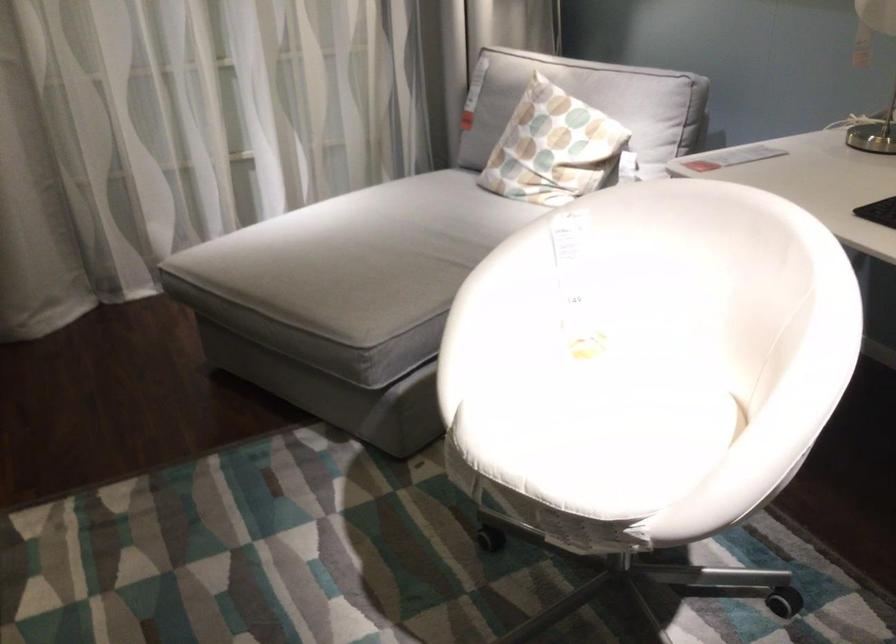
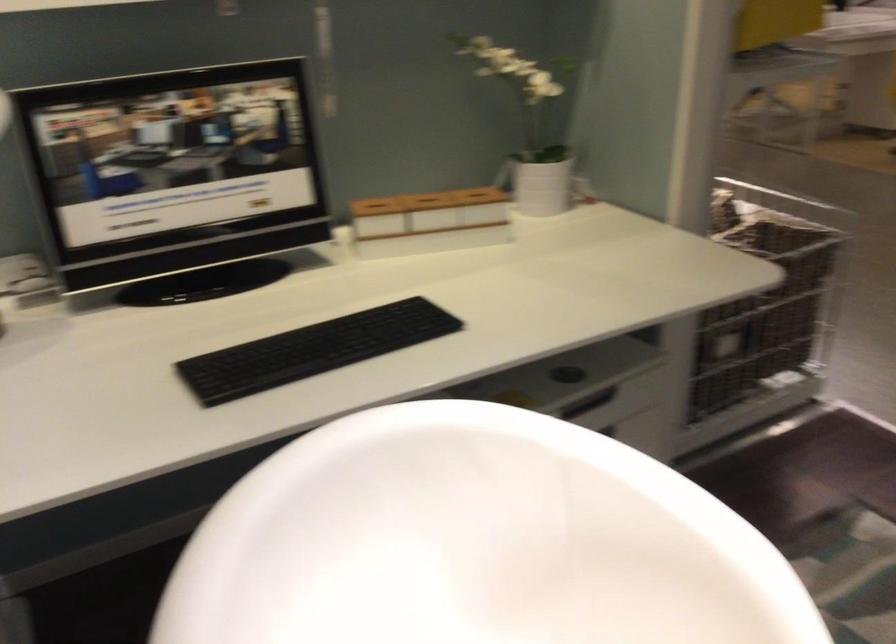
The point at (719,330) is marked in the first image. Where is the corresponding point in the second image?

(460, 614)